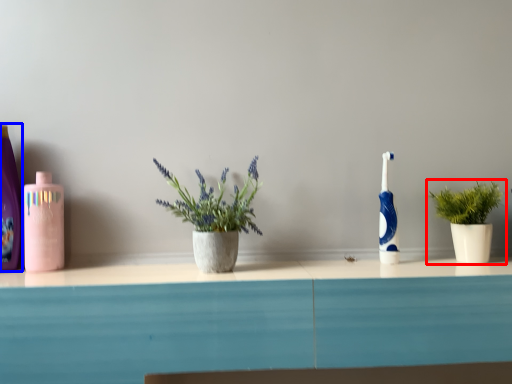
Question: Which object is further to the camera taking this photo, houseplant (highlighted by a red box) or cleaning product (highlighted by a blue box)?

Choices:
 (A) houseplant
 (B) cleaning product

Answer: (B)